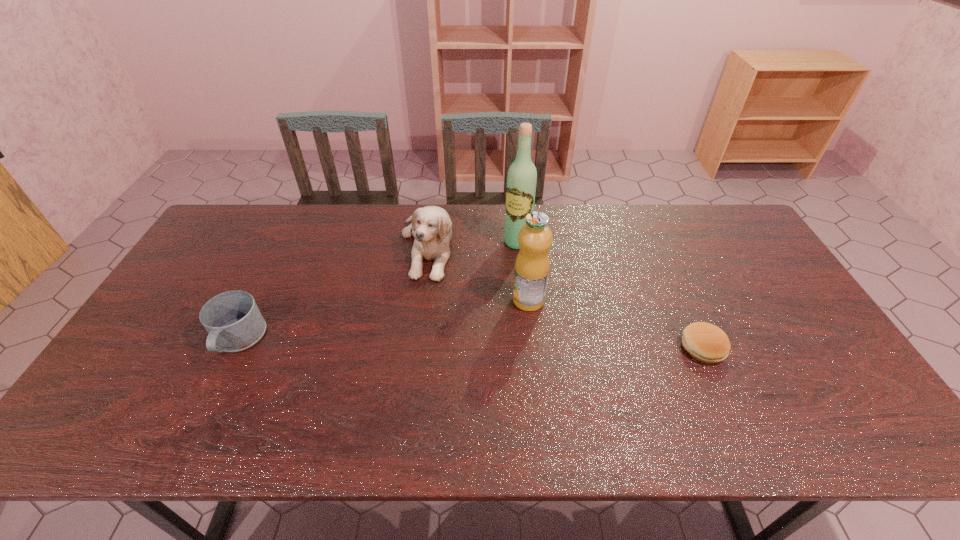
Locate an element on the screen. This screenshot has height=540, width=960. vacant area situated 0.220m on the back of the shortest object is located at coordinates (670, 275).

What are the coordinates of `free spot located on the front-facing side of the second object from left to right` in the screenshot? It's located at (434, 355).

Find the location of a particular element. This screenshot has height=540, width=960. free spot located on the front-facing side of the second object from left to right is located at coordinates (431, 322).

Where is `free space located on the front-facing side of the second object from left to right`? The image size is (960, 540). free space located on the front-facing side of the second object from left to right is located at coordinates (428, 299).

You are a GUI agent. You are given a task and a screenshot of the screen. Output one action in this format:
    pyautogui.click(x=<x>, y=<y>)
    Task: Click on the vacant space located 0.140m on the front label of the fruit juice
    The image size is (960, 540).
    Given the screenshot: What is the action you would take?
    pyautogui.click(x=488, y=339)

At what (x,y) coordinates should I click in order to perform the action: click on vacant space located 0.320m on the front label of the fruit juice. Please return your answer as a coordinate pair (x, y). Looking at the image, I should click on coord(441,383).

This screenshot has height=540, width=960. Identify the location of vacant space situated on the front label of the fruit juice. [488, 339].

This screenshot has width=960, height=540. What are the coordinates of `vacant area located on the front-facing side of the tallest object` in the screenshot? It's located at (491, 280).

Identify the location of vacant space located 0.240m on the front-facing side of the tallest object. This screenshot has height=540, width=960. (478, 298).

Identify the location of free space located on the front-facing side of the tallest object. This screenshot has height=540, width=960. (488, 285).